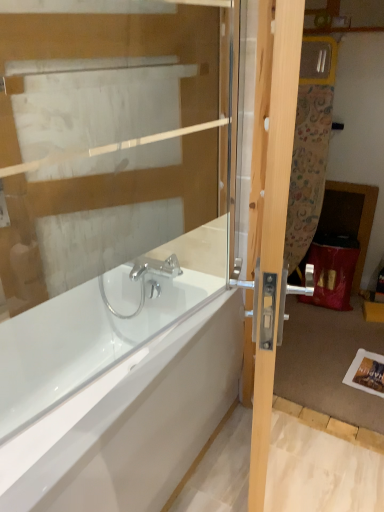
What do you see at coordinates (106, 141) in the screenshot? The height and width of the screenshot is (512, 384). I see `transparent glass door at upper center` at bounding box center [106, 141].

I want to click on light wood door at right, so click(270, 206).

The image size is (384, 512). Identify the location of transparent glass door at upper center. (106, 141).

Is point (44, 478) less distant than point (301, 25)?

That is False.

From a real-world perspective, does white glossy bathtub at center stand above light wood door at right?

No, from a real-world perspective, white glossy bathtub at center is not over light wood door at right

In the scene shown: Considering the sizes of objects white glossy bathtub at center and light wood door at right in the image provided, who is shorter, white glossy bathtub at center or light wood door at right?

With less height is white glossy bathtub at center.

Can you tell me how much white glossy bathtub at center and light wood door at right differ in facing direction?

18 degrees separate the facing orientations of white glossy bathtub at center and light wood door at right.

Which is behind, point (259, 168) or point (222, 414)?

Point (222, 414)

Between light wood door at right and white glossy bathtub at center, which one is positioned in front?

Positioned in front is light wood door at right.

From the image's perspective, is light wood door at right above white glossy bathtub at center?

Yes, from the image's perspective, light wood door at right is on top of white glossy bathtub at center.

Do you think light wood door at right is within white glossy bathtub at center, or outside of it?

light wood door at right is spatially situated outside white glossy bathtub at center.

Can you confirm if transparent glass door at upper center is thinner than white glossy bathtub at center?

Yes, transparent glass door at upper center is thinner than white glossy bathtub at center.

Based on the photo, which object is positioned more to the left, transparent glass door at upper center or white glossy bathtub at center?

From the viewer's perspective, white glossy bathtub at center appears more on the left side.

Would you consider transparent glass door at upper center to be distant from white glossy bathtub at center?

Actually, transparent glass door at upper center and white glossy bathtub at center are a little close together.

From a real-world perspective, between transparent glass door at upper center and white glossy bathtub at center, who is vertically higher?

In real-world perspective, transparent glass door at upper center is above.

Which object is wider, light wood door at right or transparent glass door at upper center?

With larger width is light wood door at right.

Is light wood door at right taller or shorter than transparent glass door at upper center?

In the image, light wood door at right appears to be taller than transparent glass door at upper center.

Considering the positions of objects light wood door at right and transparent glass door at upper center in the image provided, who is in front, light wood door at right or transparent glass door at upper center?

light wood door at right is closer to the camera.

Locate an element on the screen. This screenshot has height=512, width=384. glass door that appears on the left of light wood door at right is located at coordinates (106, 141).

In terms of size, does transparent glass door at upper center appear bigger or smaller than light wood door at right?

transparent glass door at upper center is smaller than light wood door at right.

Which object is positioned more to the left, transparent glass door at upper center or light wood door at right?

transparent glass door at upper center is more to the left.

From a real-world perspective, is transparent glass door at upper center physically located above or below light wood door at right?

Clearly, from a real-world perspective, transparent glass door at upper center is above light wood door at right.

Does point (116, 241) come in front of point (269, 211)?

No.

From a real-world perspective, which is physically below, white glossy bathtub at center or transparent glass door at upper center?

In real-world perspective, white glossy bathtub at center is lower.

This screenshot has height=512, width=384. Identify the location of bathtub that appears below the transparent glass door at upper center (from a real-world perspective). (131, 422).

I want to click on bathtub lying on the left of light wood door at right, so click(131, 422).

At what (x,y) coordinates should I click in order to perform the action: click on door that is in front of the white glossy bathtub at center. Please return your answer as a coordinate pair (x, y). This screenshot has height=512, width=384. Looking at the image, I should click on (270, 206).

Based on their spatial positions, is transparent glass door at upper center or white glossy bathtub at center further from light wood door at right?

white glossy bathtub at center is positioned further to the anchor light wood door at right.

Estimate the real-world distances between objects in this image. Which object is further from transparent glass door at upper center, white glossy bathtub at center or light wood door at right?

Based on the image, white glossy bathtub at center appears to be further to transparent glass door at upper center.

Looking at the image, which one is located closer to light wood door at right, white glossy bathtub at center or transparent glass door at upper center?

transparent glass door at upper center.

Which object lies further to the anchor point white glossy bathtub at center, light wood door at right or transparent glass door at upper center?

transparent glass door at upper center is further to white glossy bathtub at center.

From the picture: Estimate the real-world distances between objects in this image. Which object is further from white glossy bathtub at center, transparent glass door at upper center or light wood door at right?

Based on the image, transparent glass door at upper center appears to be further to white glossy bathtub at center.

When comparing their distances from transparent glass door at upper center, does light wood door at right or white glossy bathtub at center seem closer?

light wood door at right.

The image size is (384, 512). I want to click on door that lies between transparent glass door at upper center and white glossy bathtub at center from top to bottom, so click(270, 206).